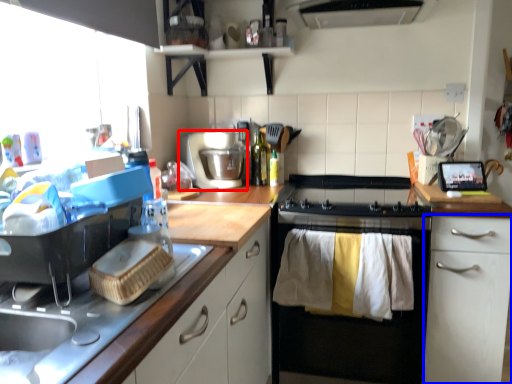
Question: Among these objects, which one is nearest to the camera, kitchen appliance (highlighted by a red box) or cabinetry (highlighted by a blue box)?

Choices:
 (A) kitchen appliance
 (B) cabinetry

Answer: (B)